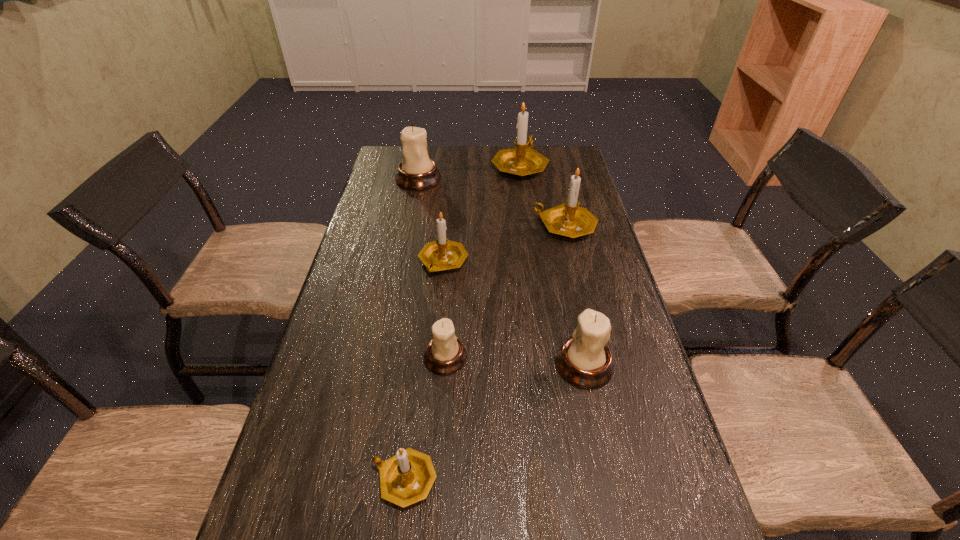
Where is `the farthest gold candle holder`? This screenshot has width=960, height=540. the farthest gold candle holder is located at coordinates (523, 160).

Locate an element on the screen. the tallest object is located at coordinates (523, 160).

What are the coordinates of `the leftmost white candle holder` in the screenshot? It's located at (416, 171).

Where is `the biggest white candle holder`? This screenshot has height=540, width=960. the biggest white candle holder is located at coordinates (416, 171).

Identify the location of the second biggest gold candle holder. The width and height of the screenshot is (960, 540). (567, 219).

You are a GUI agent. You are given a task and a screenshot of the screen. Output one action in this format:
    pyautogui.click(x=<x>, y=<y>)
    Task: Click on the second smallest gold candle holder
    
    Given the screenshot: What is the action you would take?
    pyautogui.click(x=442, y=254)

The image size is (960, 540). Find the location of `the second biggest white candle holder`. the second biggest white candle holder is located at coordinates [584, 360].

Find the location of a particular element. Image resolution: width=960 pixels, height=540 pixels. the second white candle holder from left to right is located at coordinates (445, 354).

The width and height of the screenshot is (960, 540). What are the coordinates of `the nearest candle holder` in the screenshot? It's located at (406, 478).

Locate an element on the screen. This screenshot has width=960, height=540. the smallest gold candle holder is located at coordinates tap(406, 478).